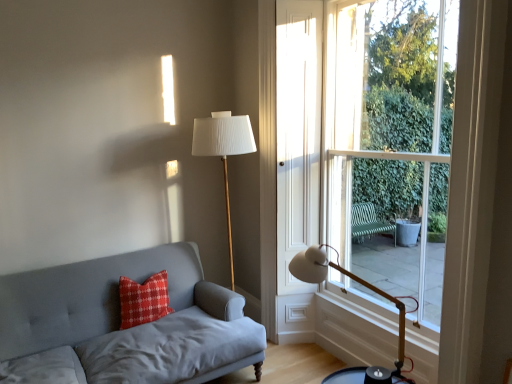
Question: Which direction should I rotate to face white pleated fabric lampshade at center, the second table lamp when ordered from front to back, — up or down?

Choices:
 (A) down
 (B) up

Answer: (A)

Question: Considering the relative sizes of matte gray fabric couch at left and white pleated fabric lampshade at center, the second table lamp when ordered from front to back, in the image provided, is matte gray fabric couch at left thinner than white pleated fabric lampshade at center, the second table lamp when ordered from front to back,?

Choices:
 (A) yes
 (B) no

Answer: (B)

Question: From the image's perspective, is matte gray fabric couch at left located above white pleated fabric lampshade at center, which is the first table lamp from back to front?

Choices:
 (A) no
 (B) yes

Answer: (A)

Question: Is matte gray fabric couch at left not within white pleated fabric lampshade at center, which is the first table lamp from back to front?

Choices:
 (A) yes
 (B) no

Answer: (A)

Question: Could you tell me if matte gray fabric couch at left is facing white pleated fabric lampshade at center, the 2th table lamp from the right?

Choices:
 (A) no
 (B) yes

Answer: (A)

Question: Does matte gray fabric couch at left have a lesser height compared to white pleated fabric lampshade at center, marked as the first table lamp in a left-to-right arrangement?

Choices:
 (A) yes
 (B) no

Answer: (A)

Question: Considering the relative positions of matte gray fabric couch at left and white pleated fabric lampshade at center, the 2th table lamp from the right, in the image provided, is matte gray fabric couch at left to the left of white pleated fabric lampshade at center, the 2th table lamp from the right, from the viewer's perspective?

Choices:
 (A) no
 (B) yes

Answer: (B)

Question: Is clear glass window at right wider than red textured pillow at left?

Choices:
 (A) yes
 (B) no

Answer: (B)

Question: Is clear glass window at right positioned beyond the bounds of red textured pillow at left?

Choices:
 (A) no
 (B) yes

Answer: (B)

Question: Is clear glass window at right far from red textured pillow at left?

Choices:
 (A) yes
 (B) no

Answer: (A)

Question: From a real-world perspective, is clear glass window at right on top of red textured pillow at left?

Choices:
 (A) no
 (B) yes

Answer: (B)

Question: Is red textured pillow at left located within clear glass window at right?

Choices:
 (A) no
 (B) yes

Answer: (A)

Question: Is clear glass window at right facing away from red textured pillow at left?

Choices:
 (A) yes
 (B) no

Answer: (B)

Question: Could white matte table lamp at lower right, positioned as the second table lamp in back-to-front order, be considered to be inside white pleated fabric lampshade at center, marked as the first table lamp in a left-to-right arrangement?

Choices:
 (A) yes
 (B) no

Answer: (B)